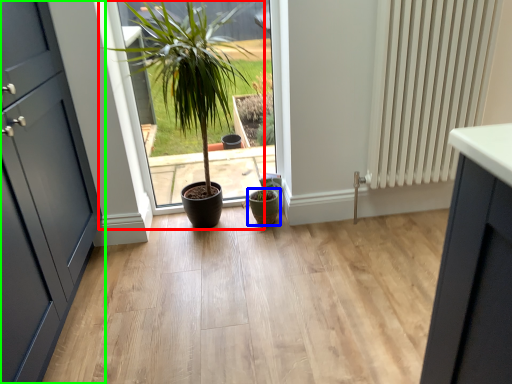
Question: Which object is the closest to the houseplant (highlighted by a red box)? Choose among these: flowerpot (highlighted by a blue box) or door (highlighted by a green box).

Choices:
 (A) flowerpot
 (B) door

Answer: (B)